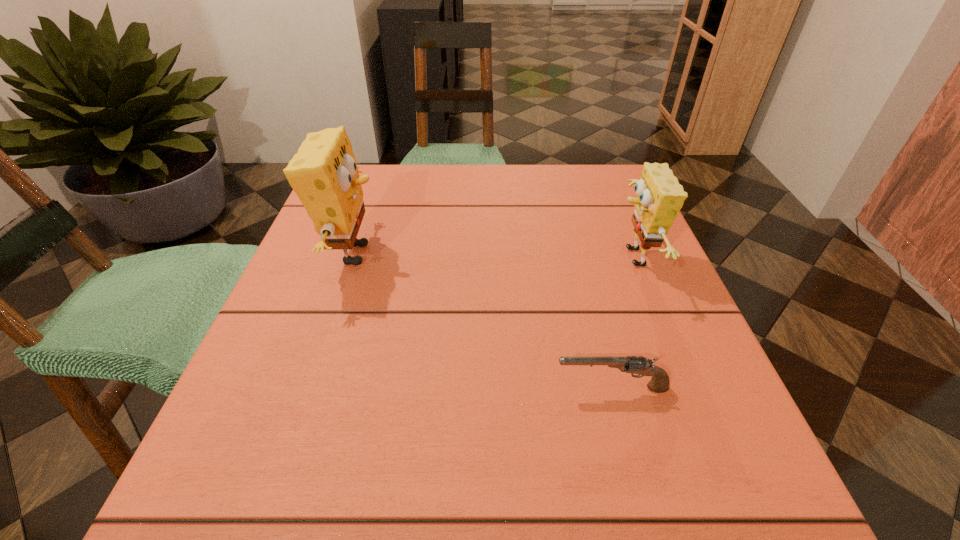
In the image, there is a desktop. In order to click on vacant area at the left edge in this screenshot , I will do `click(368, 263)`.

In the image, there is a desktop. Identify the location of vacant space at the right edge. The height and width of the screenshot is (540, 960). (686, 394).

In the image, there is a desktop. At what (x,y) coordinates should I click in order to perform the action: click on free space at the near left corner. Please return your answer as a coordinate pair (x, y). Looking at the image, I should click on (272, 489).

The image size is (960, 540). In the image, there is a desktop. In order to click on vacant space at the far right corner in this screenshot , I will do `click(587, 170)`.

The height and width of the screenshot is (540, 960). What are the coordinates of `free area in between the right sponge and the left sponge` in the screenshot? It's located at 493,256.

Locate an element on the screen. This screenshot has height=540, width=960. empty space between the tallest object and the shorter sponge is located at coordinates (493, 256).

Identify the location of empty space that is in between the second shortest object and the shortest object. The width and height of the screenshot is (960, 540). (622, 323).

The height and width of the screenshot is (540, 960). Identify the location of vacant space that's between the right sponge and the taller sponge. (493, 256).

The width and height of the screenshot is (960, 540). Find the location of `vacant point located between the tallest object and the gun`. vacant point located between the tallest object and the gun is located at coordinates (483, 321).

Locate an element on the screen. The width and height of the screenshot is (960, 540). free space that is in between the shortest object and the right sponge is located at coordinates (622, 323).